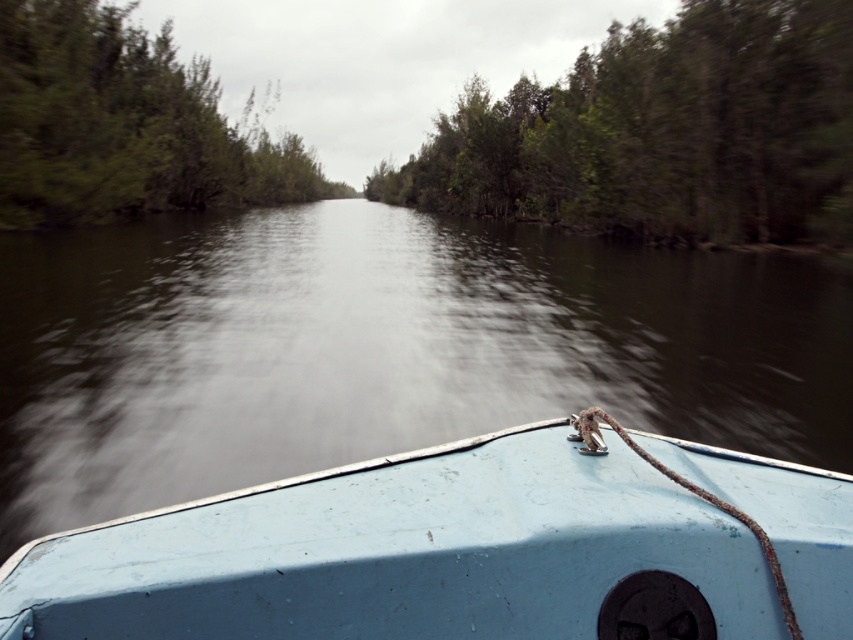
Based on the photo, you are navigating a boat and need to avoid shallow areas. The dark water at center indicates deeper water. Where should you steer the boat to stay in deeper water?

You should steer the boat towards the dark water at center since it is located at point (381, 349), which indicates deeper water.